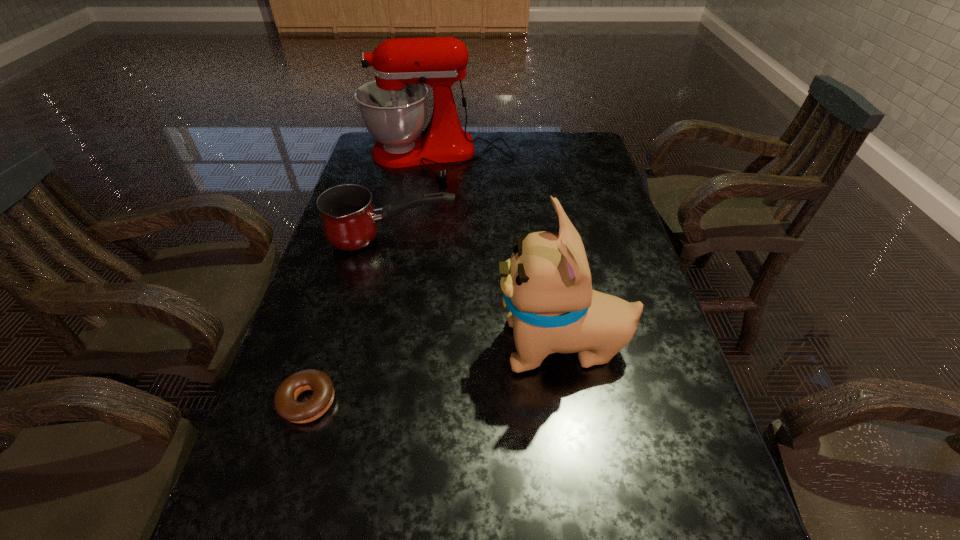
Find the location of a particular element. The width and height of the screenshot is (960, 540). free space that satisfies the following two spatial constraints: 1. on the bowl side of the mixer; 2. on the handle side of the saucepan is located at coordinates (426, 240).

I want to click on vacant space that satisfies the following two spatial constraints: 1. on the bowl side of the farthest object; 2. on the handle side of the saucepan, so click(x=426, y=240).